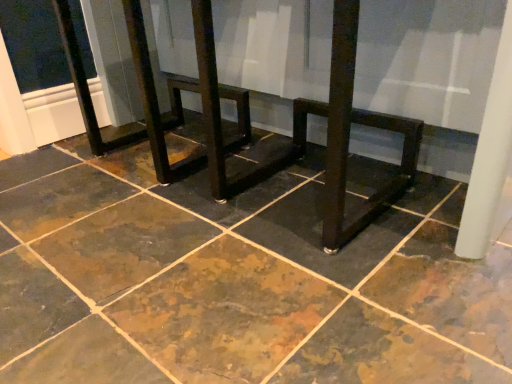
This screenshot has width=512, height=384. Identify the location of vacant space that is to the left of matte dark wood table at center. (162, 227).